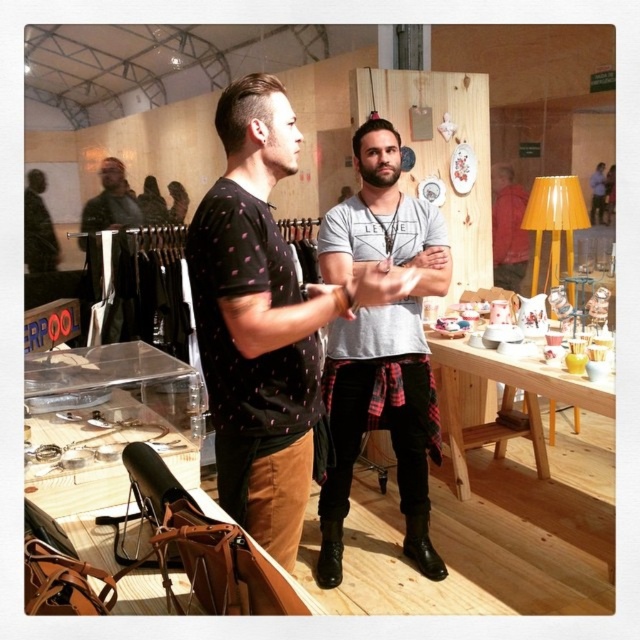
Question: Can you confirm if black dotted t-shirt at center is smaller than gray cotton t-shirt at center?

Choices:
 (A) no
 (B) yes

Answer: (B)

Question: Is black dotted t-shirt at center positioned before gray cotton t-shirt at center?

Choices:
 (A) yes
 (B) no

Answer: (A)

Question: Which of the following is the farthest from the observer?

Choices:
 (A) (339, 230)
 (B) (230, 93)

Answer: (A)

Question: Can you confirm if black dotted t-shirt at center is wider than gray cotton t-shirt at center?

Choices:
 (A) no
 (B) yes

Answer: (B)

Question: Which point is closer to the camera?

Choices:
 (A) [406, 552]
 (B) [202, 332]

Answer: (B)